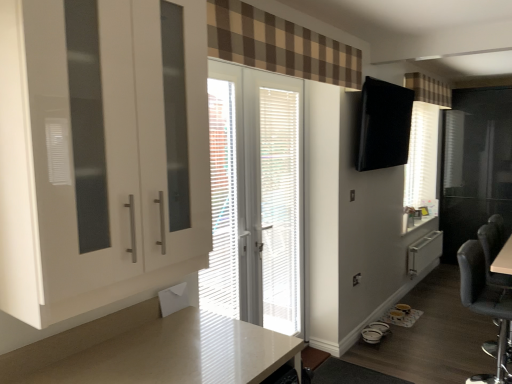
Question: In terms of height, does brown checkered curtain at upper center, placed as the 1th curtain when sorted from front to back, look taller or shorter compared to black fabric chair at lower right?

Choices:
 (A) tall
 (B) short

Answer: (B)

Question: From the image's perspective, relative to black fabric chair at lower right, is brown checkered curtain at upper center, acting as the 2th curtain starting from the right, above or below?

Choices:
 (A) below
 (B) above

Answer: (B)

Question: Estimate the real-world distances between objects in this image. Which object is farther from the black fabric chair at lower right?

Choices:
 (A) white plastic radiator at lower right
 (B) white glossy countertop at lower center
 (C) brown checkered curtain at upper center, acting as the 2th curtain starting from the right
 (D) white glossy door at center
 (E) white/textured blinds at center

Answer: (A)

Question: Estimate the real-world distances between objects in this image. Which object is farther from the white glossy door at center?

Choices:
 (A) brown checkered curtain at upper right, marked as the 2th curtain in a left-to-right arrangement
 (B) white/textured blinds at center
 (C) white glossy cabinet at left
 (D) white plastic radiator at lower right
 (E) brown checkered curtain at upper center, arranged as the 1th curtain when ordered from the bottom

Answer: (D)